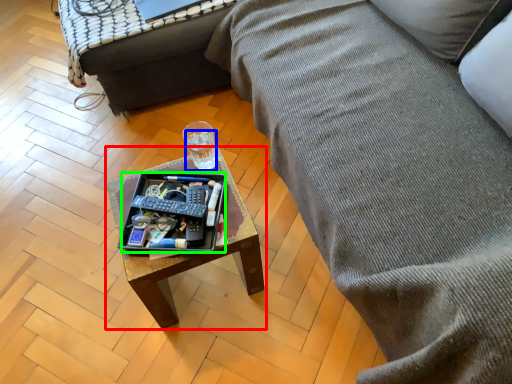
Question: Which is nearer to the coffee table (highlighted by a red box)? beverage (highlighted by a blue box) or tray (highlighted by a green box).

Choices:
 (A) beverage
 (B) tray

Answer: (B)